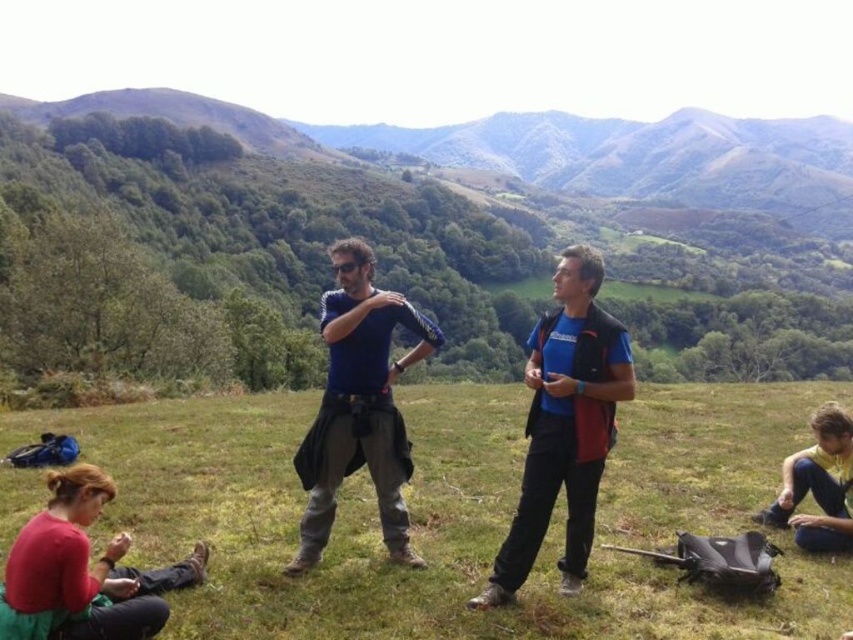
Question: Which of the following is the closest to the observer?

Choices:
 (A) blue fabric shirt at center
 (B) green grassy field at center

Answer: (B)

Question: Can you confirm if blue fabric shirt at center is positioned above blue matte shirt at center?

Choices:
 (A) yes
 (B) no

Answer: (A)

Question: Considering the real-world distances, which object is farthest from the yellow fabric shirt at lower right?

Choices:
 (A) blue fabric shirt at center
 (B) green grassy field at center

Answer: (B)

Question: Is blue matte shirt at center further to the viewer compared to yellow fabric shirt at lower right?

Choices:
 (A) no
 (B) yes

Answer: (A)

Question: Which of the following is the farthest from the observer?

Choices:
 (A) yellow fabric shirt at lower right
 (B) green grassy field at center
 (C) blue fabric shirt at center

Answer: (A)

Question: Is blue fabric shirt at center positioned before yellow fabric shirt at lower right?

Choices:
 (A) yes
 (B) no

Answer: (A)